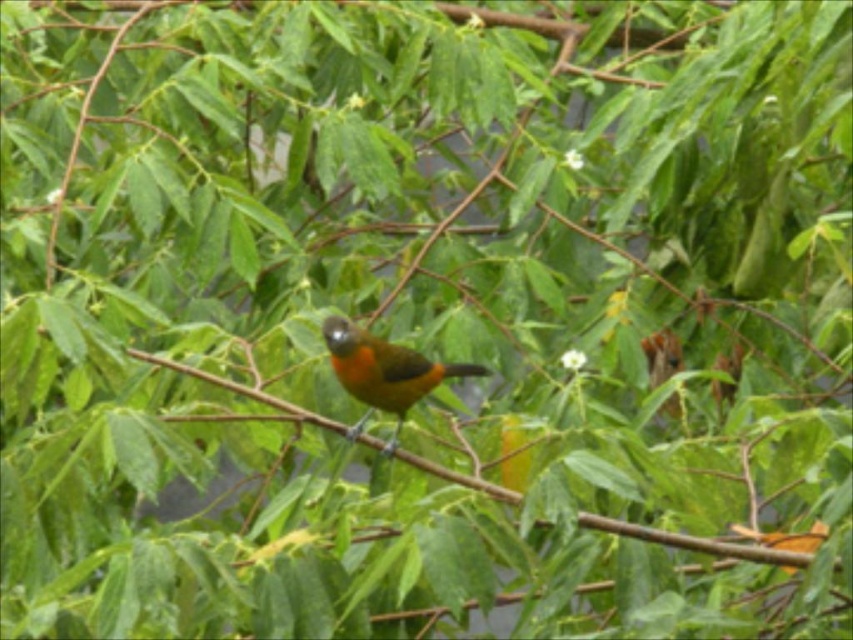
Question: Is green matte branch at center to the left of orange matte bird at center from the viewer's perspective?

Choices:
 (A) yes
 (B) no

Answer: (B)

Question: Can you confirm if green matte branch at center is positioned to the left of orange matte bird at center?

Choices:
 (A) yes
 (B) no

Answer: (B)

Question: Is green matte branch at center positioned at the back of orange matte bird at center?

Choices:
 (A) yes
 (B) no

Answer: (B)

Question: Which point is farther from the camera taking this photo?

Choices:
 (A) coord(384,449)
 (B) coord(585,516)

Answer: (A)